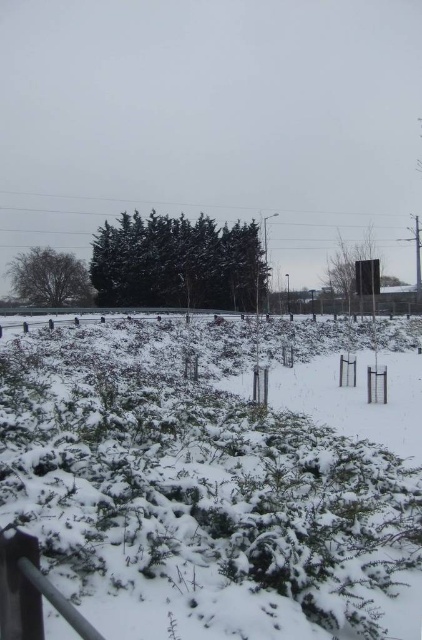
You are standing in the snowy landscape and want to determine which of the two points, point (27, 412) or point (162, 285), is nearer to you. Based on the scene description, which point is closer?

Point (27, 412) is closer to the camera than point (162, 285).